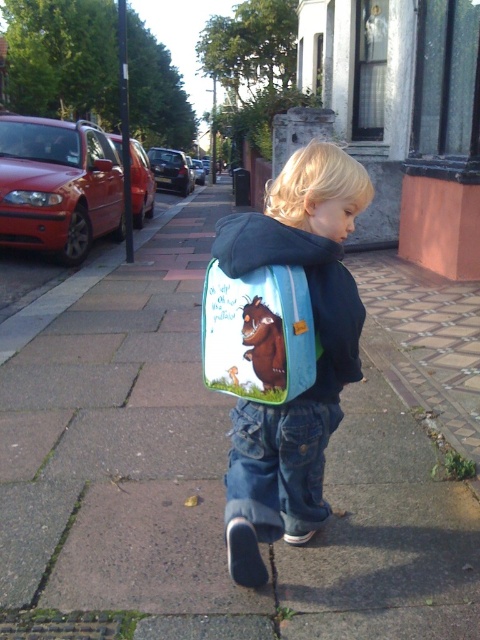
Can you confirm if brown stone pavement at center is thinner than blue fabric backpack at center?

No, brown stone pavement at center is not thinner than blue fabric backpack at center.

Find the location of a particular element. The height and width of the screenshot is (640, 480). brown stone pavement at center is located at coordinates (201, 477).

Measure the distance between blue fabric backpack at center and camera.

A distance of 1.52 meters exists between blue fabric backpack at center and camera.

Which is more to the left, blue fabric backpack at center or blue fabric sweatshirt at center?

blue fabric backpack at center is more to the left.

Is point (292, 433) positioned in front of point (273, 227)?

No, it is behind (273, 227).

The image size is (480, 640). Find the location of `blue fabric backpack at center`. blue fabric backpack at center is located at coordinates (316, 362).

Does point (434, 634) come closer to viewer compared to point (274, 337)?

No.

Locate an element on the screen. brown stone pavement at center is located at coordinates (201, 477).

Between point (408, 602) and point (252, 280), which one is positioned behind?

Positioned behind is point (408, 602).

Find the location of a particular element. The image size is (480, 640). brown stone pavement at center is located at coordinates (201, 477).